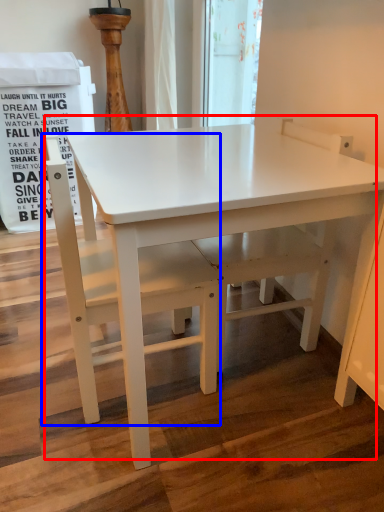
Question: Which object appears farthest to the camera in this image, table (highlighted by a red box) or chair (highlighted by a blue box)?

Choices:
 (A) table
 (B) chair

Answer: (B)